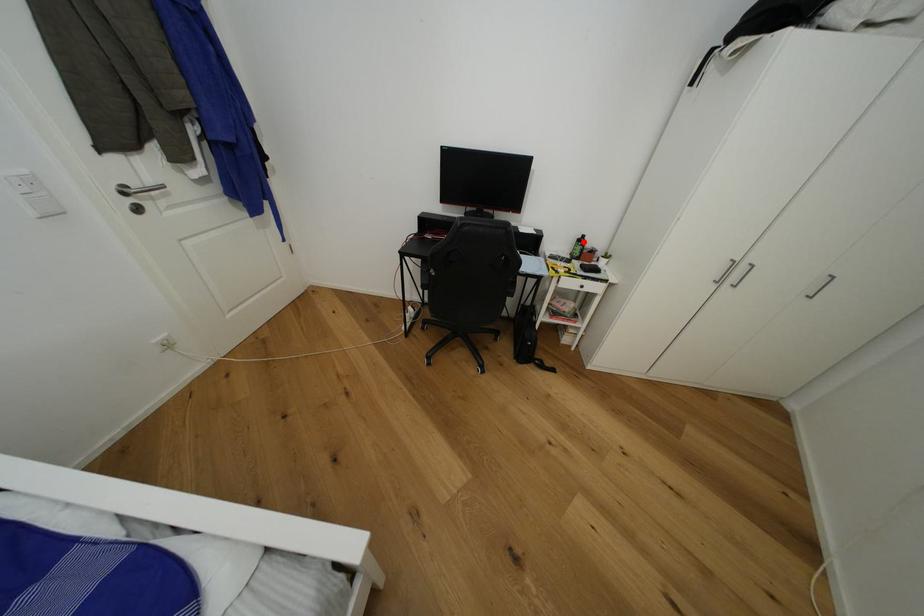
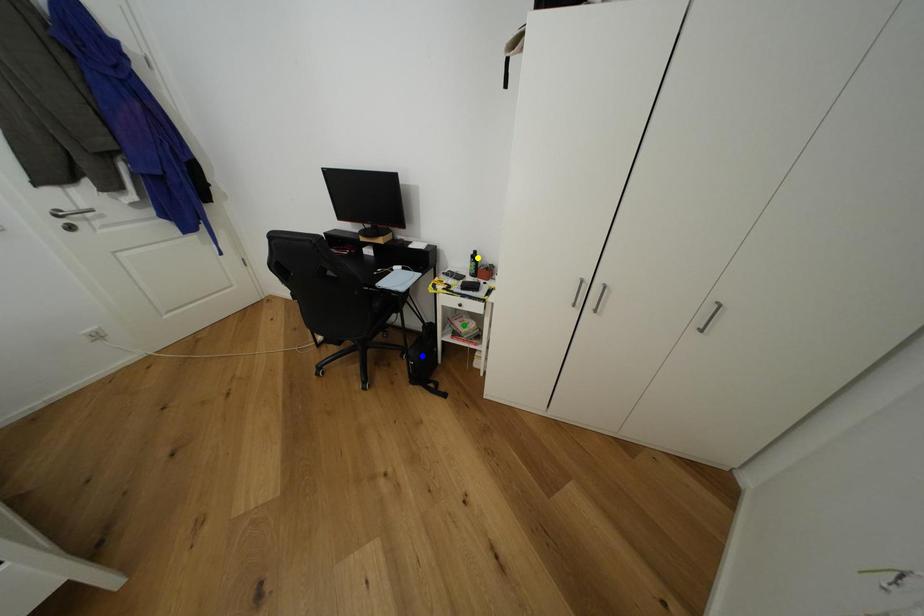
Question: I am providing you with two images of the same scene from different viewpoints. A red point is marked on the first image. You are given multiple points on the second image. Can you choose the point in image 2 that corresponds to the point in image 1?

Choices:
 (A) green point
 (B) yellow point
 (C) blue point

Answer: (B)